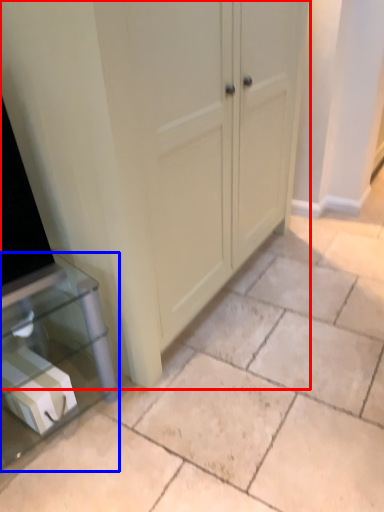
Question: Which point is closer to the camera, cupboard (highlighted by a red box) or furniture (highlighted by a blue box)?

Choices:
 (A) cupboard
 (B) furniture

Answer: (A)